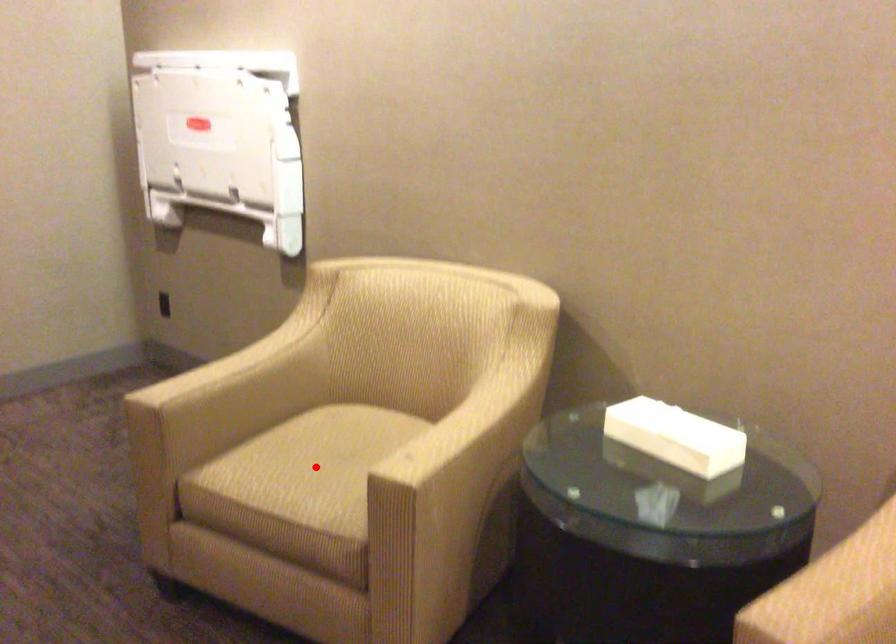
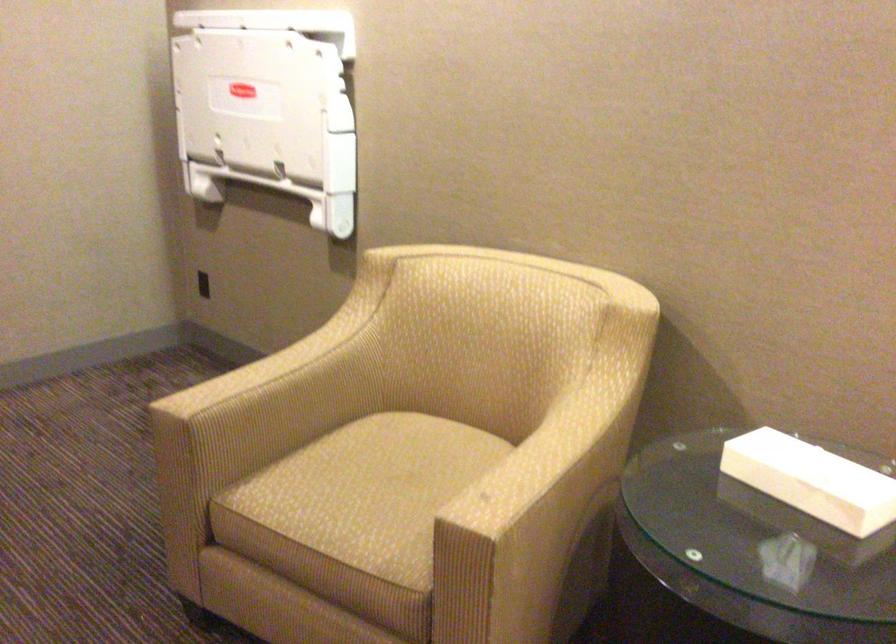
Question: A red point is marked in image1. In image2, is the corresponding 3D point closer to the camera or farther? Reply with the corresponding letter.

Choices:
 (A) The corresponding 3D point is closer.
 (B) The corresponding 3D point is farther.

Answer: (A)